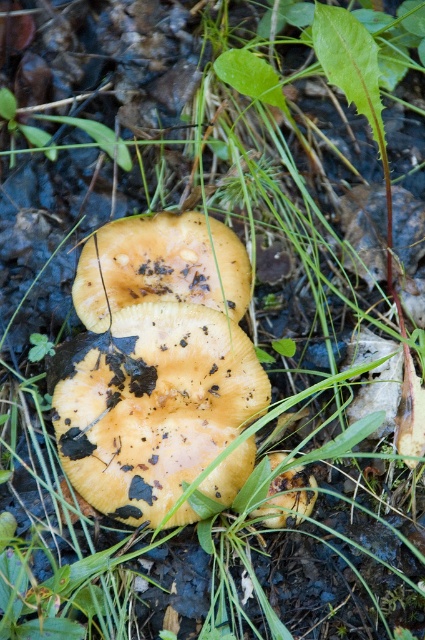
Question: Which is nearer to the yellowish-brown textured mushroom at center?

Choices:
 (A) yellow matte mushroom at center
 (B) light brown textured mushroom at center

Answer: (B)

Question: Is light brown textured mushroom at center positioned behind yellow matte mushroom at center?

Choices:
 (A) yes
 (B) no

Answer: (A)

Question: Which is farther from the yellowish-brown textured mushroom at center?

Choices:
 (A) light brown textured mushroom at center
 (B) yellow matte mushroom at center

Answer: (B)

Question: Which point is farther from the camera taking this photo?

Choices:
 (A) (300, 486)
 (B) (62, 371)

Answer: (B)

Question: Considering the relative positions of yellowish-brown textured mushroom at center and yellow matte mushroom at center in the image provided, where is yellowish-brown textured mushroom at center located with respect to yellow matte mushroom at center?

Choices:
 (A) right
 (B) left

Answer: (B)

Question: Can you confirm if yellowish-brown textured mushroom at center is bigger than light brown textured mushroom at center?

Choices:
 (A) no
 (B) yes

Answer: (B)